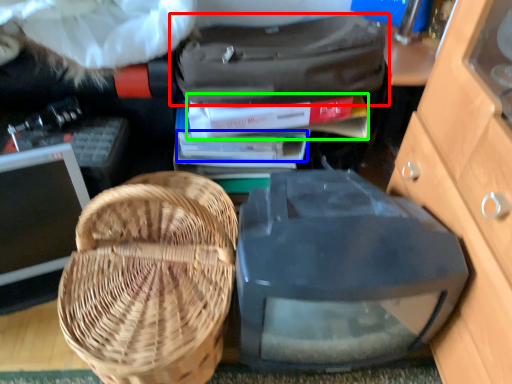
Question: Which object is the farthest from luggage and bags (highlighted by a red box)? Choose among these: book (highlighted by a blue box) or book (highlighted by a green box).

Choices:
 (A) book
 (B) book

Answer: (A)